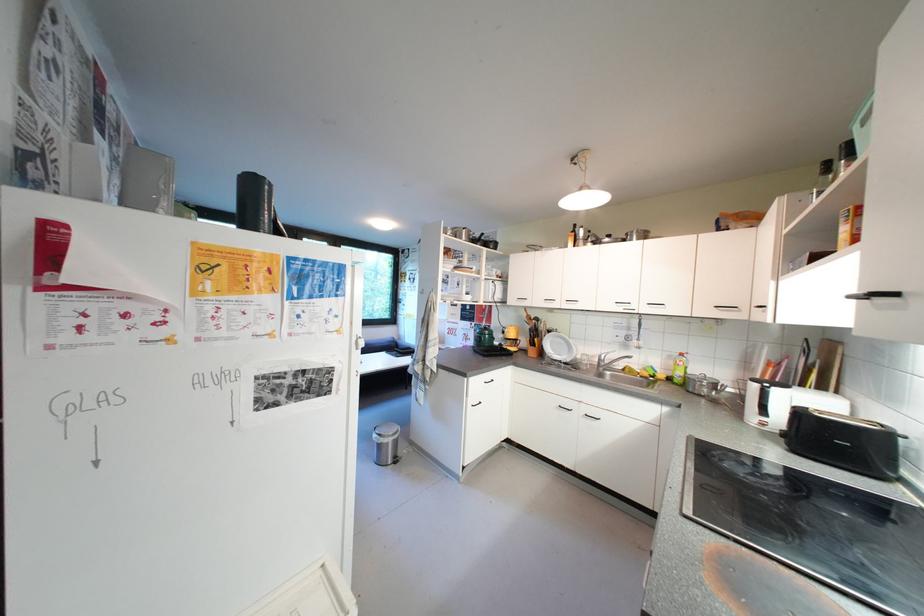
The width and height of the screenshot is (924, 616). What are the coordinates of `small silver pot` in the screenshot? It's located at (385, 444).